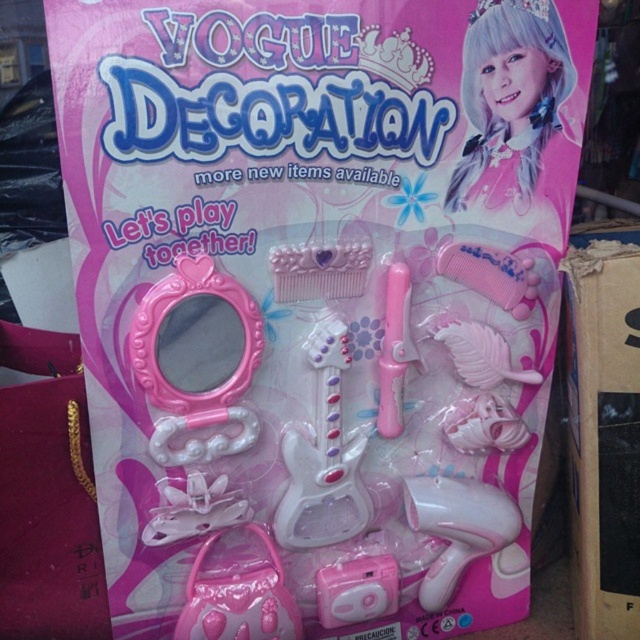
You are a toy designer who needs to place a sticker on the packaging. The sticker must be placed exactly at the center of the packaging. The pink plastic mirror at center is located at point 0.562, 0.309. Is the mirror positioned at the center of the packaging?

The pink plastic mirror at center is located at point (196, 358). The center of the packaging would be at point (320, 320). Since the coordinates of the mirror are slightly offset from the center coordinates, the mirror is not exactly at the center of the packaging.

You are a child trying to take a photo of the white matte doll at upper right with a camera. Can you reach the camera if you are standing next to the doll?

The white matte doll at upper right and camera are 1.03 meters apart. Since the distance between them is 1.03 meters, a child would need to move 1.03 meters to reach the camera from the doll.